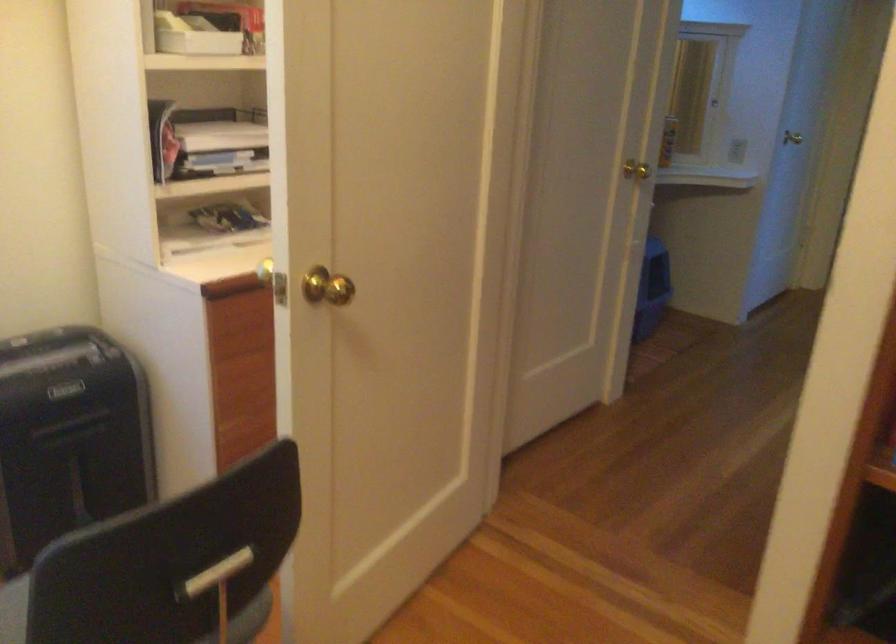
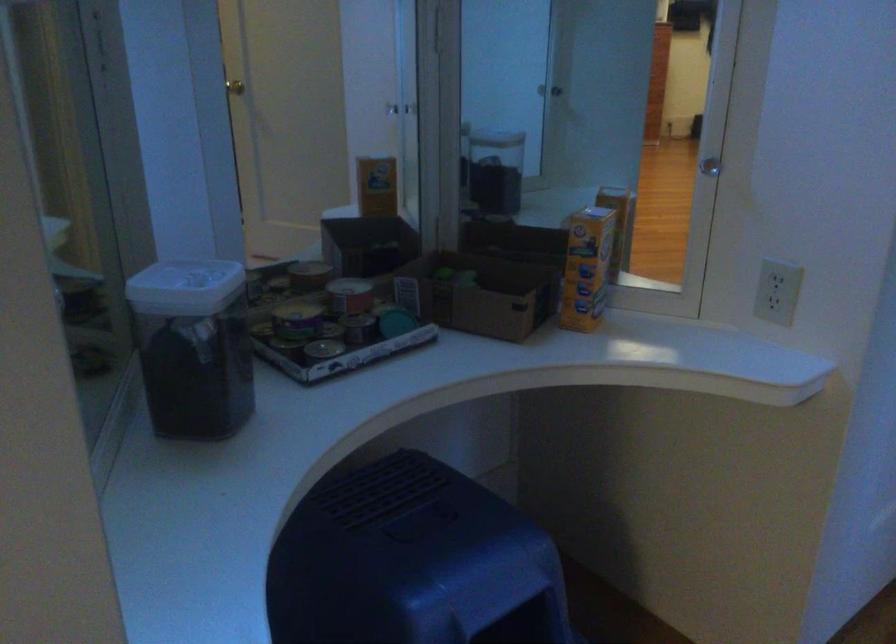
Which direction would the cameraman need to move to produce the second image?

The movement direction of the cameraman is right, forward.